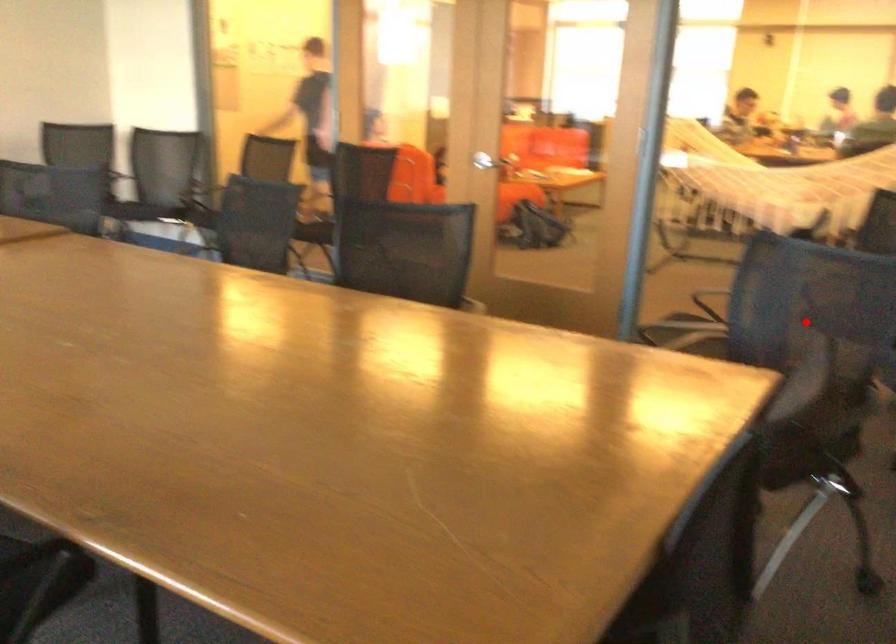
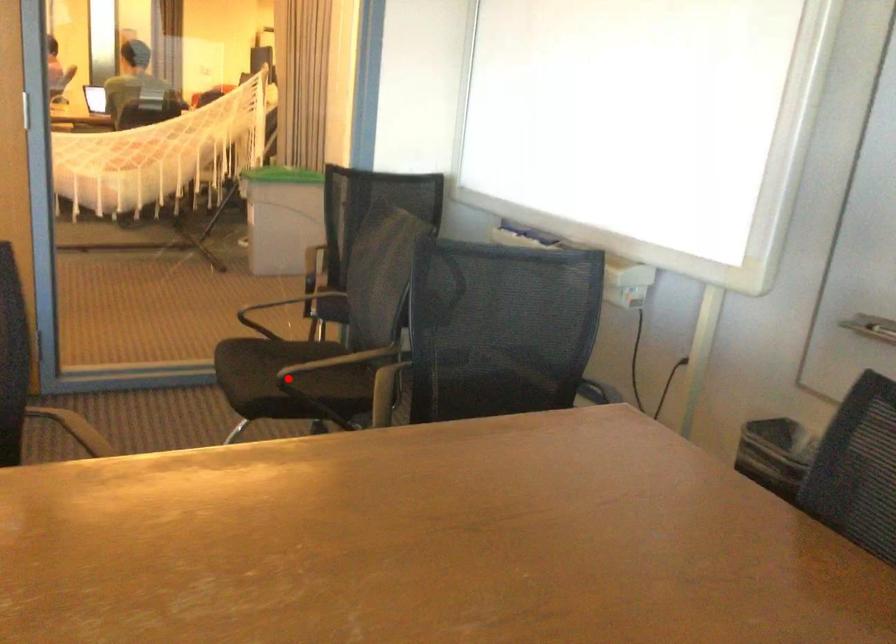
I am providing you with two images of the same scene from different viewpoints. A red point is marked on the first image and another point is marked on the second image. Does the point marked in image1 correspond to the same location as the one in image2?

No